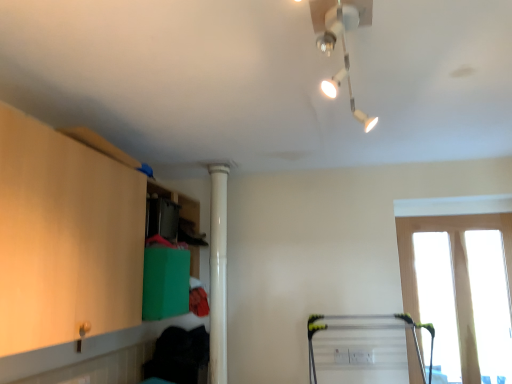
The width and height of the screenshot is (512, 384). What do you see at coordinates (453, 272) in the screenshot?
I see `transparent glass door at right` at bounding box center [453, 272].

You are a GUI agent. You are given a task and a screenshot of the screen. Output one action in this format:
    pyautogui.click(x=<x>, y=<y>)
    Task: Click on the transparent glass door at right
    Image resolution: width=512 pixels, height=384 pixels.
    Given the screenshot: What is the action you would take?
    pyautogui.click(x=453, y=272)

I want to click on transparent glass door at right, so click(x=453, y=272).